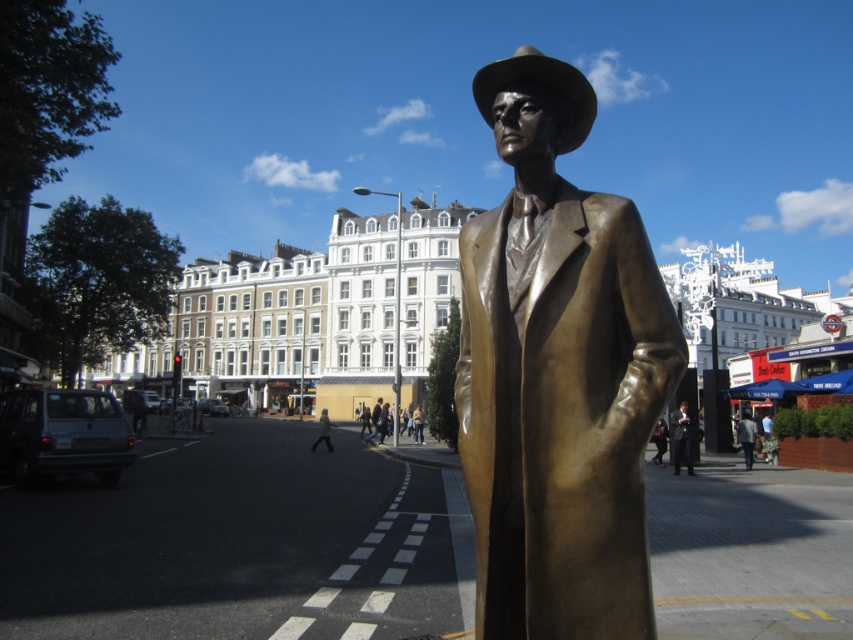
You are standing at the statue and looking towards the street. There are two points marked on the ground in front of you. The first point is at coordinates point [479,72] and the second point is at coordinates point [323,440]. Which point is closer to you?

Point [479,72] is in front of point [323,440], so it is closer to you.

You are a tourist standing on the city street looking at the bronze statue. Where is the shiny bronze statue located relative to the point marked at coordinates (556, 374)?

The shiny bronze statue at center is exactly at the point marked at coordinates (556, 374).

You are a city planner who needs to install a new streetlight between the shiny bronze statue at center and the dark gray suit at center. The streetlight requires a minimum distance of 50 meters between the two objects to be installed safely. Based on the scene description, can the streetlight be placed between them?

The shiny bronze statue at center is only 49.68 meters from the dark gray suit at center, which is less than the required 50 meters. Therefore, the streetlight cannot be safely installed between them.